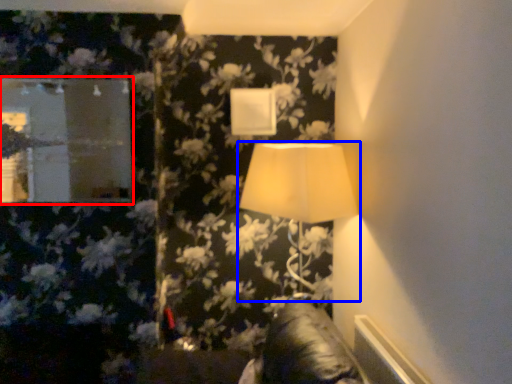
Question: Which object is further to the camera taking this photo, mirror (highlighted by a red box) or lamp (highlighted by a blue box)?

Choices:
 (A) mirror
 (B) lamp

Answer: (A)